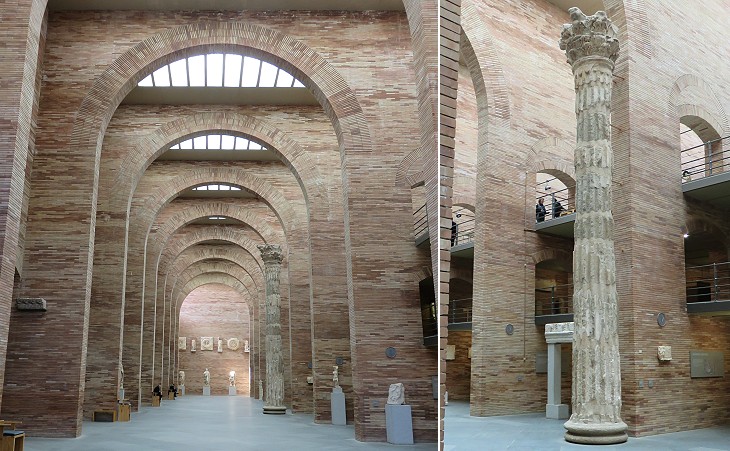
The width and height of the screenshot is (730, 451). In order to click on brick wall in this screenshot , I will do `click(669, 49)`, `click(544, 84)`, `click(61, 37)`.